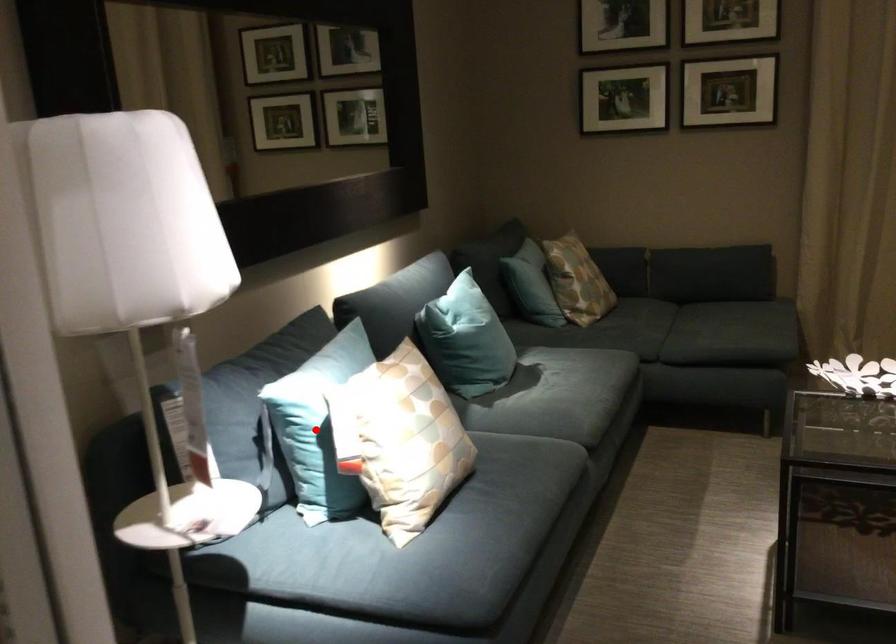
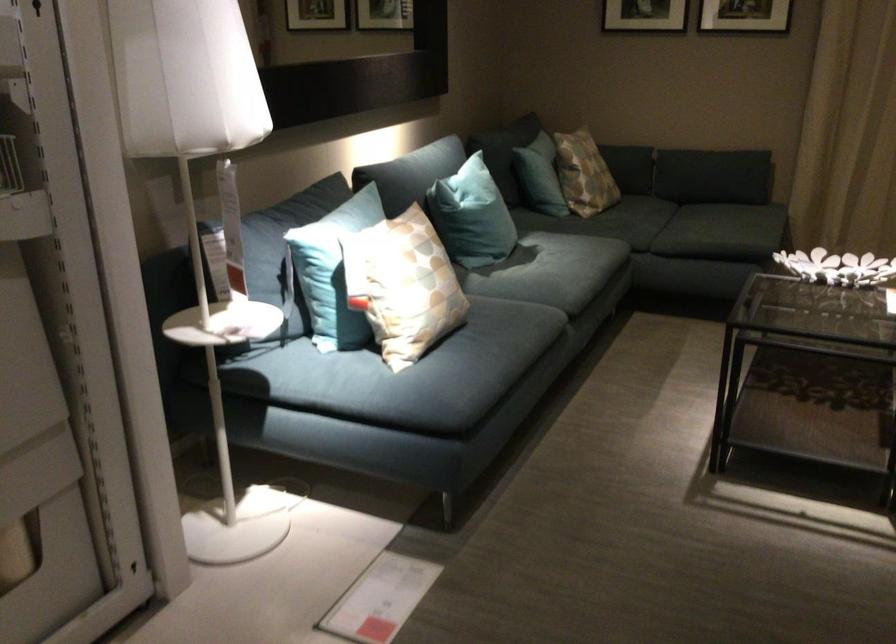
In the second image, find the point that corresponds to the highlighted location in the first image.

(332, 270)